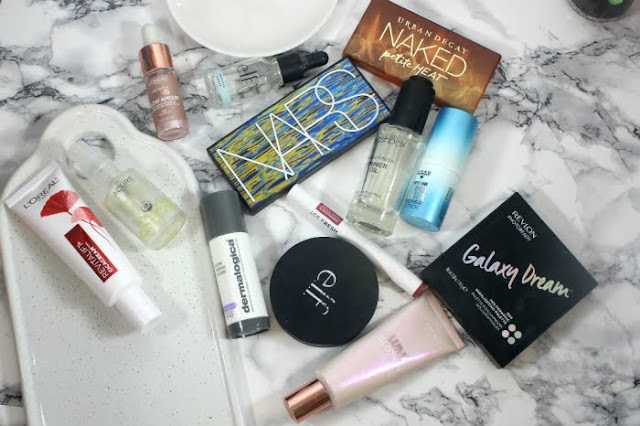
The height and width of the screenshot is (426, 640). Find the location of `box`. box is located at coordinates (504, 244), (461, 75), (300, 142).